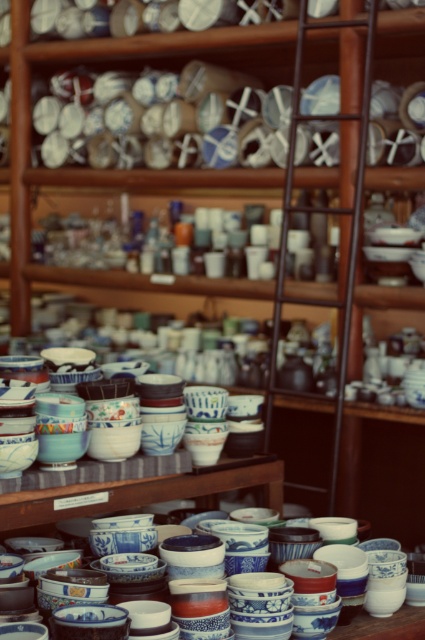
Does point (79, 376) lie in front of point (133, 458)?

No, it is behind (133, 458).

Which is behind, point (65, 410) or point (246, 484)?

Point (246, 484)

The width and height of the screenshot is (425, 640). Identify the location of blue and white ceramic bowls at center. (61, 412).

The height and width of the screenshot is (640, 425). I want to click on blue and white ceramic bowls at center, so click(x=61, y=412).

Is blue and white ceramic bowls at center taller than blue and white porcelain bowls at center?

Yes.

Is blue and white ceramic bowls at center above blue and white porcelain bowls at center?

Correct, blue and white ceramic bowls at center is located above blue and white porcelain bowls at center.

Does point (110, 396) lie in front of point (402, 627)?

No, (110, 396) is further to viewer.

Identify the location of blue and white ceramic bowls at center. Image resolution: width=425 pixels, height=640 pixels. (61, 412).

Is blue glazed bowls at center wider than blue and white porcelain bowls at center?

Indeed, blue glazed bowls at center has a greater width compared to blue and white porcelain bowls at center.

Which is behind, point (79, 483) or point (346, 628)?

The point (79, 483) is behind.

Image resolution: width=425 pixels, height=640 pixels. In order to click on blue glazed bowls at center in this screenshot , I will do `click(130, 486)`.